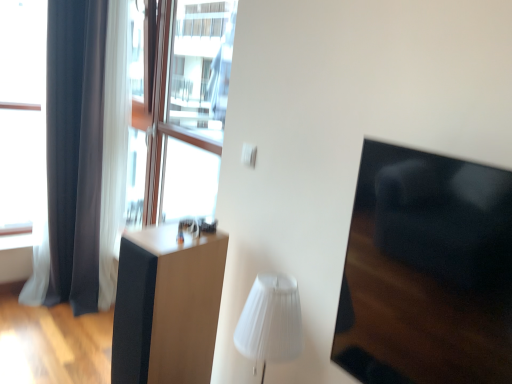
Question: Does matte black speaker at center have a lesser height compared to black glossy armchair at right?

Choices:
 (A) no
 (B) yes

Answer: (A)

Question: Is matte black speaker at center touching black glossy armchair at right?

Choices:
 (A) yes
 (B) no

Answer: (B)

Question: Is black glossy armchair at right inside matte black speaker at center?

Choices:
 (A) yes
 (B) no

Answer: (B)

Question: From the image's perspective, does matte black speaker at center appear higher than black glossy armchair at right?

Choices:
 (A) no
 (B) yes

Answer: (A)

Question: Is matte black speaker at center at the right side of black glossy armchair at right?

Choices:
 (A) no
 (B) yes

Answer: (A)

Question: From a real-world perspective, is matte black speaker at center on black glossy armchair at right?

Choices:
 (A) no
 (B) yes

Answer: (A)

Question: From the image's perspective, would you say black glossy armchair at right is shown under transparent glass window at upper left?

Choices:
 (A) yes
 (B) no

Answer: (A)

Question: From a real-world perspective, is black glossy armchair at right under transparent glass window at upper left?

Choices:
 (A) yes
 (B) no

Answer: (A)

Question: From the image's perspective, is black glossy armchair at right above transparent glass window at upper left?

Choices:
 (A) no
 (B) yes

Answer: (A)

Question: Does black glossy armchair at right come in front of transparent glass window at upper left?

Choices:
 (A) yes
 (B) no

Answer: (A)

Question: Is black glossy armchair at right oriented towards transparent glass window at upper left?

Choices:
 (A) no
 (B) yes

Answer: (A)

Question: Are black glossy armchair at right and transparent glass window at upper left making contact?

Choices:
 (A) no
 (B) yes

Answer: (A)

Question: Is white pleated shade at center positioned behind matte black speaker at center?

Choices:
 (A) yes
 (B) no

Answer: (B)